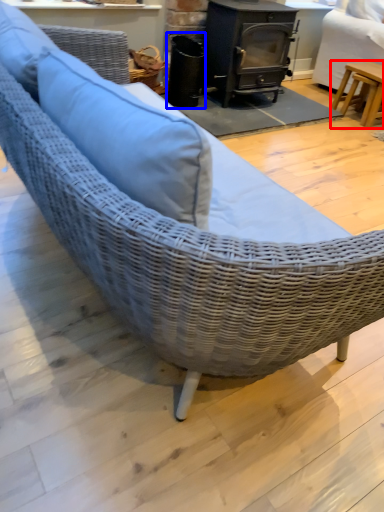
Question: Which object appears closest to the camera in this image, table (highlighted by a red box) or appliance (highlighted by a blue box)?

Choices:
 (A) table
 (B) appliance

Answer: (B)